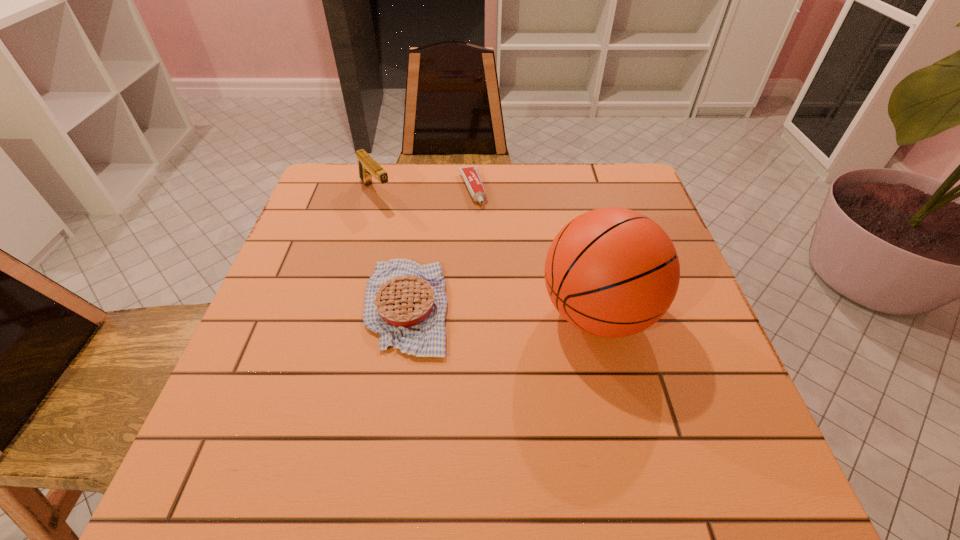
In the image, there is a desktop. At what (x,y) coordinates should I click in order to perform the action: click on vacant space at the near edge. Please return your answer as a coordinate pair (x, y). The height and width of the screenshot is (540, 960). Looking at the image, I should click on (328, 412).

In the image, there is a desktop. Where is `vacant space at the left edge`? The height and width of the screenshot is (540, 960). vacant space at the left edge is located at coordinates (285, 353).

In the image, there is a desktop. Where is `free space at the right edge`? free space at the right edge is located at coordinates (699, 375).

Where is `free space at the far right corner of the desktop`? Image resolution: width=960 pixels, height=540 pixels. free space at the far right corner of the desktop is located at coordinates (592, 206).

Locate an element on the screen. Image resolution: width=960 pixels, height=540 pixels. empty location between the rightmost object and the toothpaste is located at coordinates (535, 251).

Locate an element on the screen. This screenshot has width=960, height=540. vacant area that lies between the pistol and the second shortest object is located at coordinates (391, 249).

Locate an element on the screen. vacant point located between the tallest object and the third tallest object is located at coordinates (502, 310).

Where is `empty location between the toothpaste and the pistol`? Image resolution: width=960 pixels, height=540 pixels. empty location between the toothpaste and the pistol is located at coordinates (423, 191).

Where is `vacant space that's between the pistol and the tallest object`? Image resolution: width=960 pixels, height=540 pixels. vacant space that's between the pistol and the tallest object is located at coordinates click(487, 253).

What are the coordinates of `free space between the toothpaste and the pistol` in the screenshot? It's located at (423, 191).